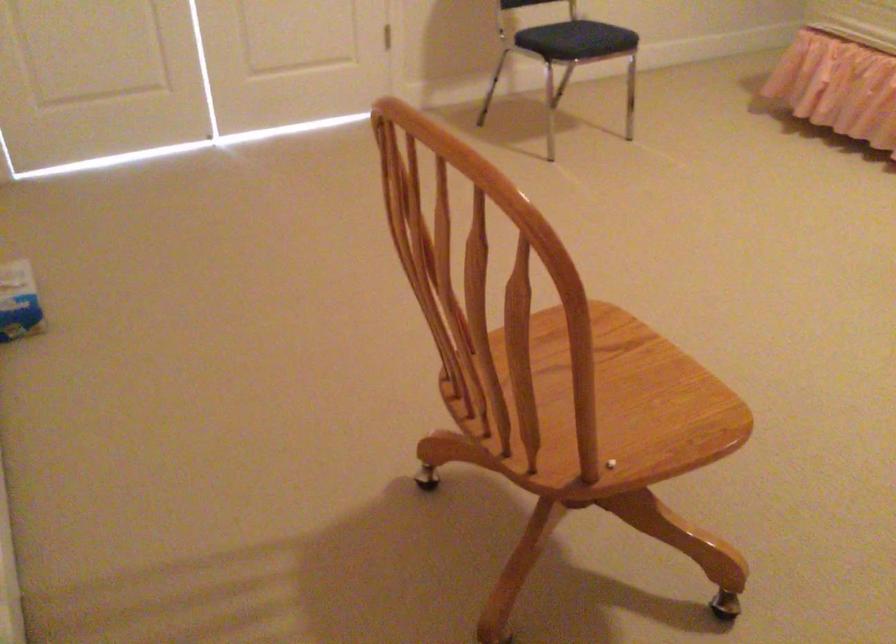
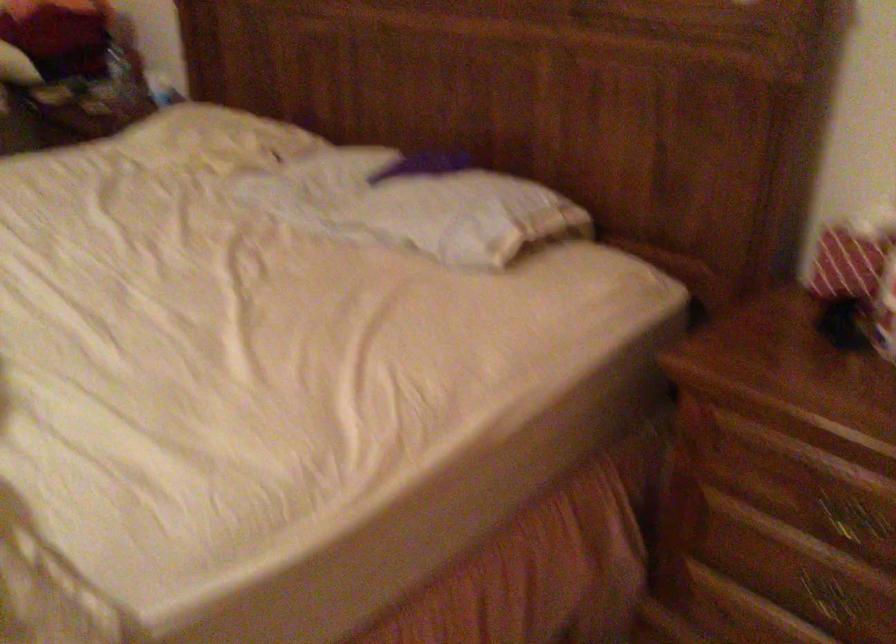
Which direction would the cameraman need to move to produce the second image?

The cameraman moved toward right, forward.